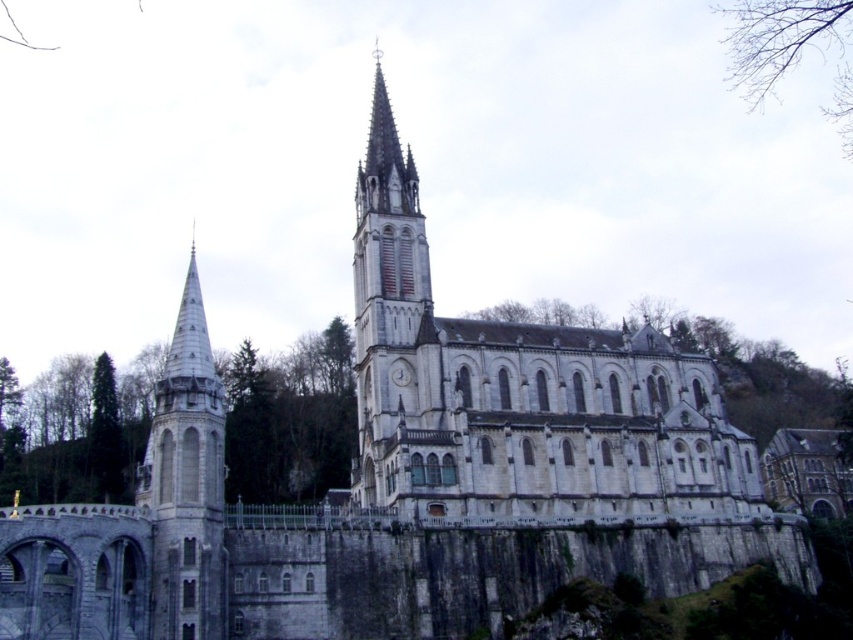
Question: Can you confirm if white stone church at center is bigger than smooth stone clock tower at center?

Choices:
 (A) yes
 (B) no

Answer: (B)

Question: Is white stone spire at left positioned at the back of green leafy tree at center?

Choices:
 (A) yes
 (B) no

Answer: (B)

Question: Where is white stone church at center located in relation to white stone spire at left in the image?

Choices:
 (A) right
 (B) left

Answer: (A)

Question: Which point is closer to the camera?

Choices:
 (A) (262, 458)
 (B) (376, 368)
 (C) (503, 410)

Answer: (B)

Question: Which point is farther to the camera?

Choices:
 (A) (489, 394)
 (B) (817, 33)
 (C) (178, 477)
 (D) (236, 484)

Answer: (B)

Question: Which of these objects is positioned farthest from the green leafy tree at center?

Choices:
 (A) bare branches at upper right
 (B) white stone spire at left

Answer: (A)